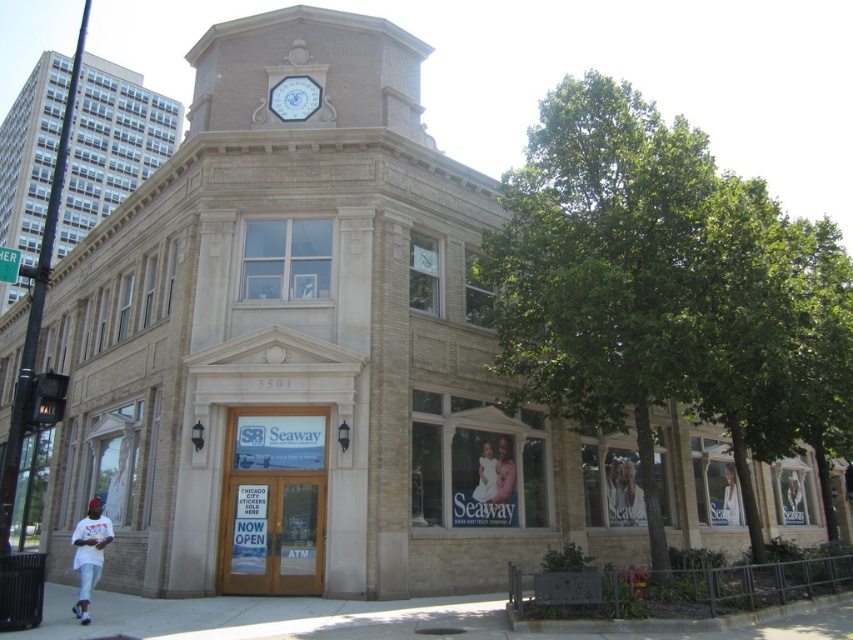
Between point (90, 113) and point (306, 118), which one is positioned in front?

Point (306, 118) is more forward.

How far apart are brick building at upper left and white glossy clock at upper center?

brick building at upper left is 68.72 meters from white glossy clock at upper center.

This screenshot has height=640, width=853. Identify the location of brick building at upper left. (111, 145).

Does green leafy tree at right have a greater width compared to white glossy clock at upper center?

Yes, green leafy tree at right is wider than white glossy clock at upper center.

Can you confirm if green leafy tree at right is taller than white glossy clock at upper center?

Yes, green leafy tree at right is taller than white glossy clock at upper center.

Find the location of a particular element. green leafy tree at right is located at coordinates (666, 292).

Is green leafy tree at right wider than brick building at upper left?

In fact, green leafy tree at right might be narrower than brick building at upper left.

Is point (576, 296) positioned after point (36, 216)?

No, (576, 296) is in front of (36, 216).

Which is behind, point (575, 284) or point (38, 115)?

Point (38, 115)

The image size is (853, 640). In order to click on green leafy tree at right in this screenshot , I will do `click(666, 292)`.